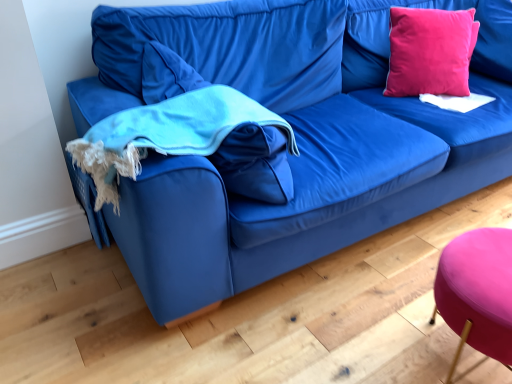
Question: Considering the positions of point (220, 142) and point (446, 64), is point (220, 142) closer or farther from the camera than point (446, 64)?

Choices:
 (A) closer
 (B) farther

Answer: (A)

Question: From a real-world perspective, is turquoise fleece blanket at left positioned above or below pink velvet pillow at upper right?

Choices:
 (A) below
 (B) above

Answer: (A)

Question: Which is farther from the pink velvet pillow at upper right?

Choices:
 (A) turquoise fleece blanket at left
 (B) purple fabric stool at lower right

Answer: (B)

Question: Considering the real-world distances, which object is farthest from the purple fabric stool at lower right?

Choices:
 (A) pink velvet pillow at upper right
 (B) turquoise fleece blanket at left

Answer: (A)